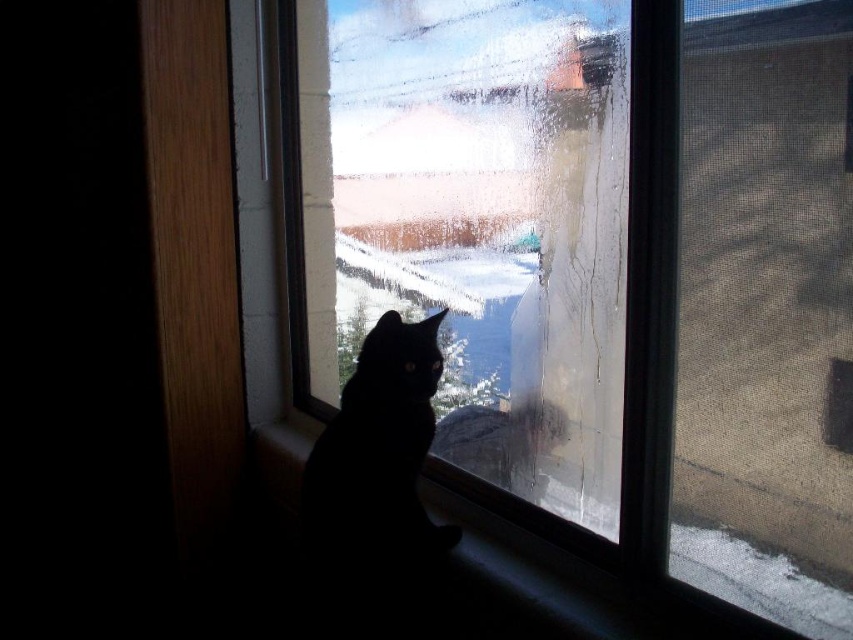
Is transparent glass window at center wider than smooth wood window sill at lower center?

Correct, the width of transparent glass window at center exceeds that of smooth wood window sill at lower center.

Does transparent glass window at center appear over smooth wood window sill at lower center?

Correct, transparent glass window at center is located above smooth wood window sill at lower center.

Where is `transparent glass window at center`? transparent glass window at center is located at coordinates (469, 221).

Locate an element on the screen. This screenshot has height=640, width=853. transparent glass window at center is located at coordinates [469, 221].

Does transparent glass window at center have a smaller size compared to black matte cat at center?

Actually, transparent glass window at center might be larger than black matte cat at center.

Can you confirm if transparent glass window at center is bigger than black matte cat at center?

Yes, transparent glass window at center is bigger than black matte cat at center.

Does point (695, 355) come in front of point (421, 451)?

Yes, point (695, 355) is in front of point (421, 451).

This screenshot has width=853, height=640. In order to click on transparent glass window at center in this screenshot , I will do 469,221.

Does point (325, 548) lie in front of point (517, 593)?

No, it is not.

Is point (426, 348) positioned after point (479, 557)?

No, (426, 348) is in front of (479, 557).

Identify the location of black matte cat at center. This screenshot has width=853, height=640. (379, 451).